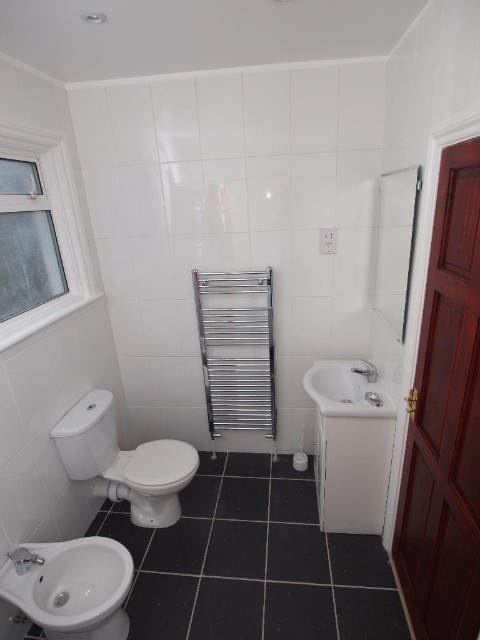
Is white glossy bidet at lower left to the right of white glossy toilet bowl at lower left from the viewer's perspective?

No, white glossy bidet at lower left is not to the right of white glossy toilet bowl at lower left.

Between point (115, 637) and point (168, 451), which one is positioned in front?

Point (115, 637) is in front.

This screenshot has width=480, height=640. Identify the location of white glossy bidet at lower left. (72, 588).

Locate an element on the screen. white plastic window at left is located at coordinates (54, 225).

Which is more to the right, white plastic window at left or white glossy sink at lower right?

white glossy sink at lower right is more to the right.

What do you see at coordinates (54, 225) in the screenshot? The image size is (480, 640). I see `white plastic window at left` at bounding box center [54, 225].

Identify the location of white plastic window at left. (54, 225).

Can you confirm if white glossy toilet bowl at lower left is positioned to the right of white glossy sink at lower right?

No, white glossy toilet bowl at lower left is not to the right of white glossy sink at lower right.

Can you confirm if white glossy toilet bowl at lower left is bigger than white glossy sink at lower right?

Indeed, white glossy toilet bowl at lower left has a larger size compared to white glossy sink at lower right.

Describe the element at coordinates (156, 481) in the screenshot. This screenshot has height=640, width=480. I see `white glossy toilet bowl at lower left` at that location.

Locate an element on the screen. white glossy toilet bowl at lower left is located at coordinates (156, 481).